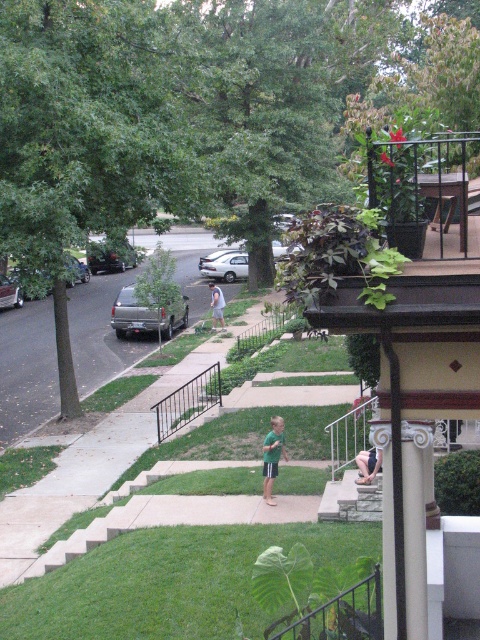
Does point (37, 353) come behind point (107, 260)?

No.

Is gray asphalt sidewalk at center wider than shiny silver suv at left?

Answer: Indeed, gray asphalt sidewalk at center has a greater width compared to shiny silver suv at left.

The image size is (480, 640). What do you see at coordinates (26, 369) in the screenshot?
I see `gray asphalt sidewalk at center` at bounding box center [26, 369].

Locate an element on the screen. The image size is (480, 640). gray asphalt sidewalk at center is located at coordinates click(x=26, y=369).

Is point (376, 618) in front of point (216, 385)?

Yes, point (376, 618) is closer to viewer.

The width and height of the screenshot is (480, 640). In order to click on green painted metal railing at lower center in this screenshot , I will do `click(343, 614)`.

Does gray asphalt sidewalk at center appear on the left side of black metal rail at lower center?

Yes, gray asphalt sidewalk at center is to the left of black metal rail at lower center.

In the scene shown: Does gray asphalt sidewalk at center appear under black metal rail at lower center?

No, gray asphalt sidewalk at center is not below black metal rail at lower center.

Is point (21, 342) positioned behind point (192, 412)?

Yes, point (21, 342) is farther from viewer.

This screenshot has height=640, width=480. Find the location of `gray asphalt sidewalk at center`. gray asphalt sidewalk at center is located at coordinates (26, 369).